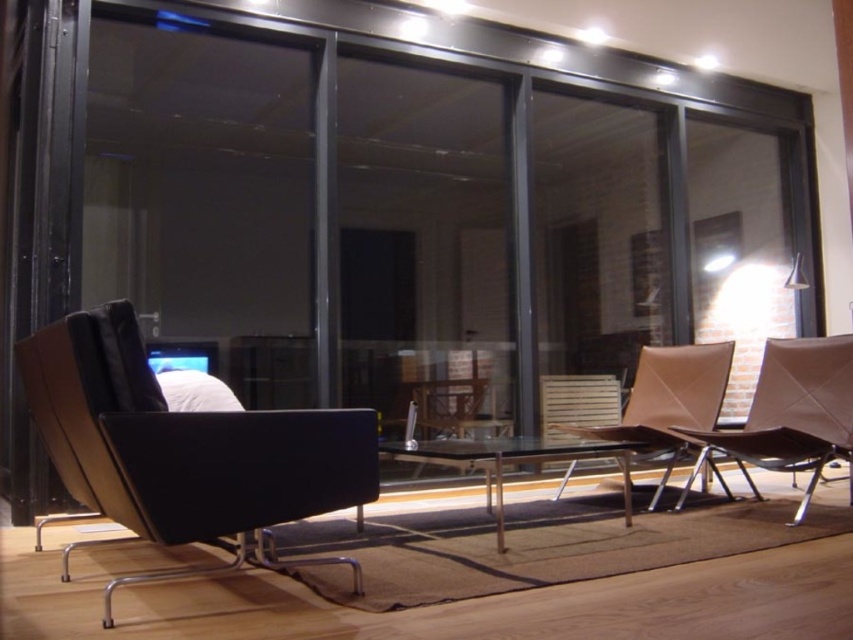
Can you confirm if leather textured chair at center is positioned above transparent glass table at center?

Indeed, leather textured chair at center is positioned over transparent glass table at center.

Based on the photo, which is more to the right, leather textured chair at center or transparent glass table at center?

leather textured chair at center

Who is more distant from viewer, [683,356] or [549,460]?

Positioned behind is point [683,356].

Image resolution: width=853 pixels, height=640 pixels. I want to click on leather textured chair at center, so click(x=668, y=401).

Can you confirm if brown leather chair at lower right is taller than transparent glass table at center?

Indeed, brown leather chair at lower right has a greater height compared to transparent glass table at center.

From the picture: Who is lower down, brown leather chair at lower right or transparent glass table at center?

transparent glass table at center

Who is more forward, (759, 381) or (625, 512)?

Point (625, 512) is in front.

Find the location of `brown leather chair at lower right`. brown leather chair at lower right is located at coordinates (791, 412).

Who is positioned more to the right, brown leather chair at lower right or leather textured chair at center?

brown leather chair at lower right

Is brown leather chair at lower right further to the viewer compared to leather textured chair at center?

That is False.

Find the location of a particular element. brown leather chair at lower right is located at coordinates (791, 412).